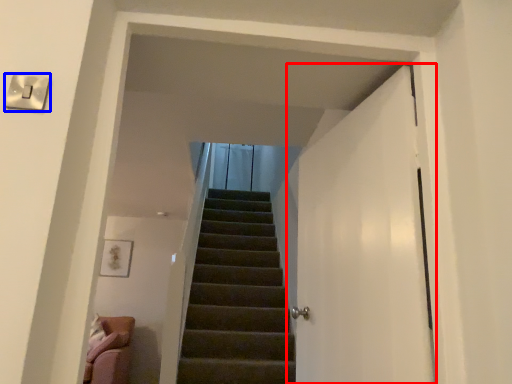
Question: Which point is closer to the camera, door (highlighted by a red box) or electric outlet (highlighted by a blue box)?

Choices:
 (A) door
 (B) electric outlet

Answer: (B)